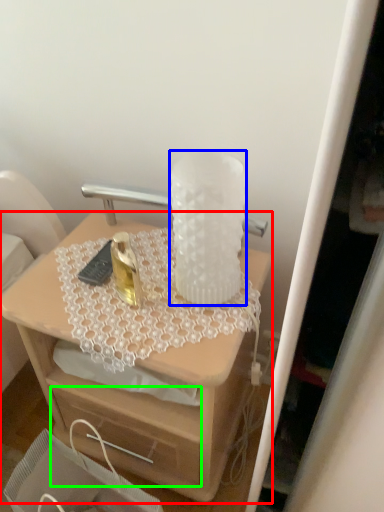
Question: Based on their relative distances, which object is nearer to desk (highlighted by a red box)? Choose from vase (highlighted by a blue box) and drawer (highlighted by a green box).

Choices:
 (A) vase
 (B) drawer

Answer: (B)